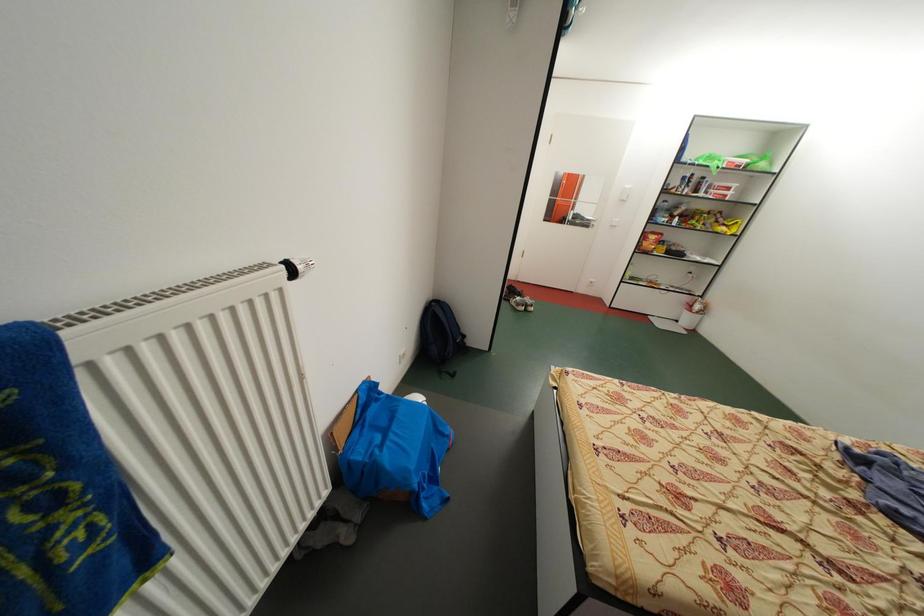
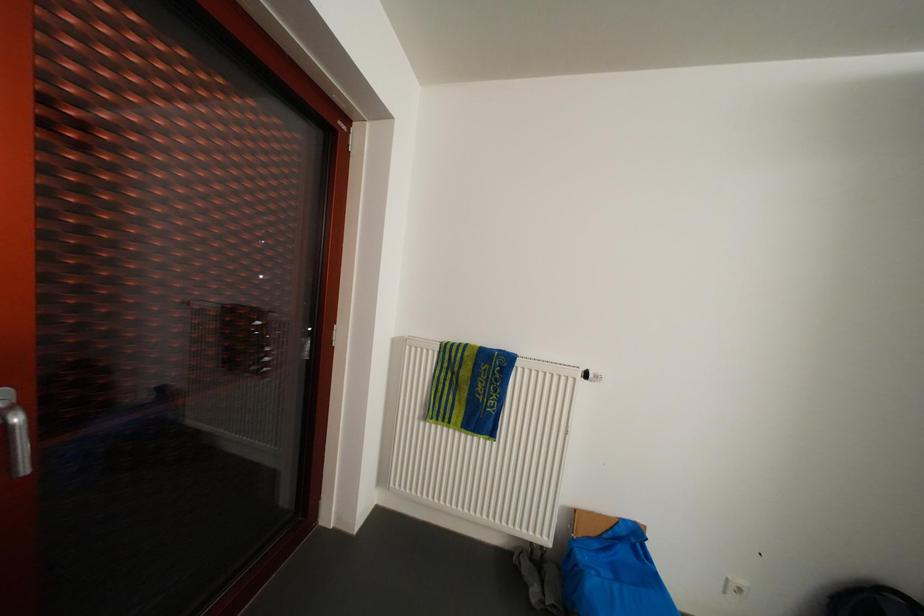
Question: The camera is either moving clockwise (left) or counter-clockwise (right) around the object. The first image is from the beginning of the video and the second image is from the end. Is the camera moving left or right when shooting the video?

Choices:
 (A) Left
 (B) Right

Answer: (B)